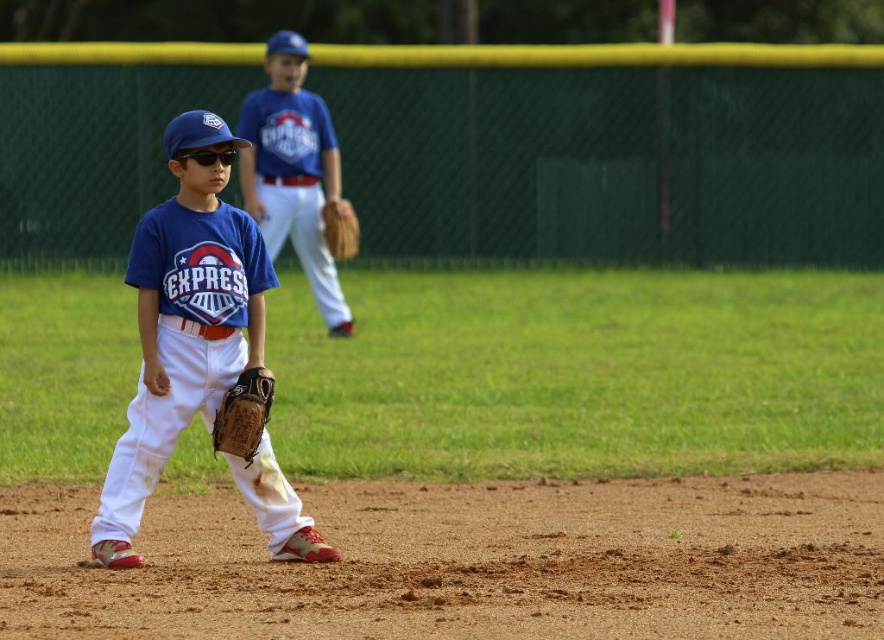
Question: Among these objects, which one is nearest to the camera?

Choices:
 (A) matte blue jersey at center
 (B) blue jersey at center
 (C) brown leather glove at center

Answer: (A)

Question: Is brown leather glove at lower left above brown leather glove at center?

Choices:
 (A) no
 (B) yes

Answer: (A)

Question: Can you confirm if blue jersey at center is positioned to the right of brown leather glove at center?

Choices:
 (A) no
 (B) yes

Answer: (A)

Question: Can you confirm if matte blue jersey at center is thinner than brown leather glove at center?

Choices:
 (A) no
 (B) yes

Answer: (A)

Question: Which object is closer to the camera taking this photo?

Choices:
 (A) brown leather glove at center
 (B) matte blue jersey at center
 (C) blue jersey at center
 (D) brown leather glove at lower left

Answer: (D)

Question: Based on their relative distances, which object is nearer to the brown leather glove at lower left?

Choices:
 (A) brown leather glove at center
 (B) blue jersey at center
 (C) matte blue jersey at center

Answer: (C)